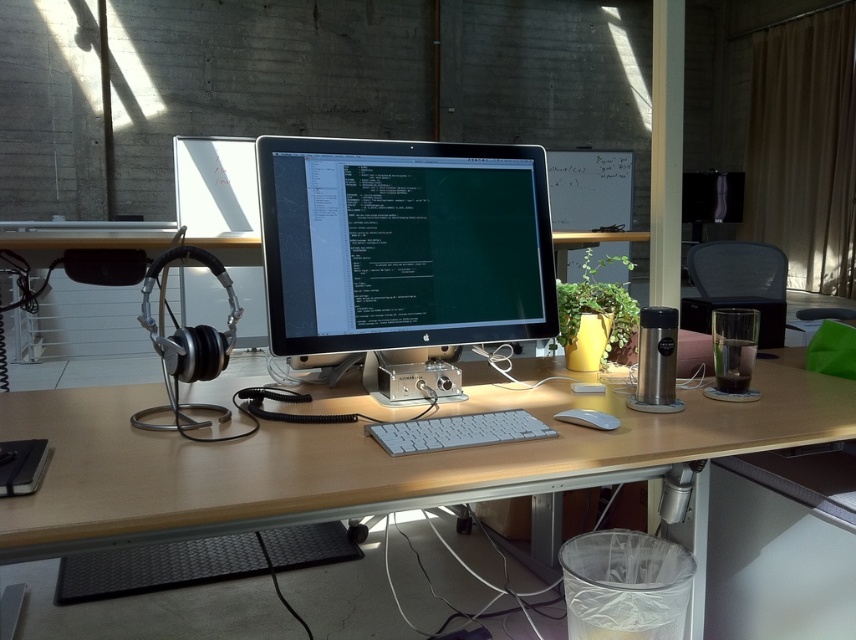
You are setting up a new desk and want to place a large plant between the satin black monitor at center and the white plastic keyboard at center. Which object should the plant be closer to if you want it to be closer to the larger object?

The plant should be closer to the satin black monitor at center since it is larger than the white plastic keyboard at center.

You are organizing your desk and want to place a new keyboard between the matte white desk at center and the white matte mouse at center. Based on their positions, where should you place the keyboard?

The matte white desk at center is below the white matte mouse at center, so placing the keyboard between them would mean positioning it above the matte white desk at center and below the white matte mouse at center.

You are a delivery robot with a height of 1.6 meters. You need to deliver a package to the desk in the image. The package is placed at point (508, 252). Can you reach the point without hitting your head?

The distance of point (508, 252) from camera is 1.58 meters. Since the robot is 1.6 meters tall, it will hit its head if it reaches the point.